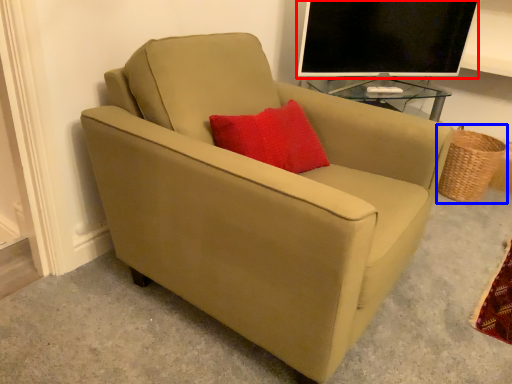
Question: Which object is further to the camera taking this photo, television (highlighted by a red box) or basket (highlighted by a blue box)?

Choices:
 (A) television
 (B) basket

Answer: (B)